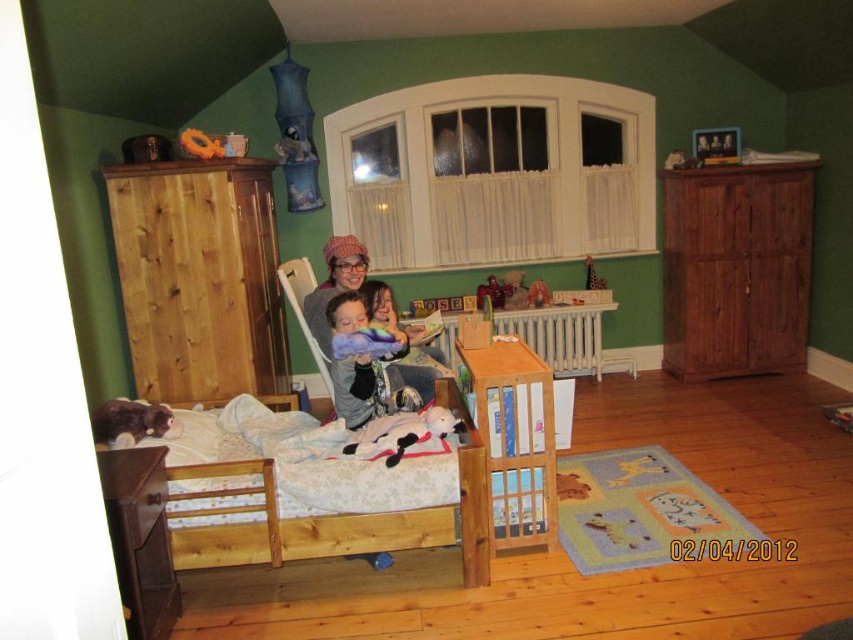
You are a child trying to reach the rubber ring at center from the soft plush toy at center. Which direction should you move to get there?

The rubber ring at center is above the soft plush toy at center, so you should move upward to reach it.

You are a parent trying to place a small toy on the purple blanket at center. The toy has a diameter of 10 cm. The point at coordinates (334, 284) is on the purple blanket. If the blanket is 1.2 meters wide, can the toy fit on the blanket without overlapping the edges?

The purple blanket at center is 1.2 meters wide, which is 120 cm. The toy has a diameter of 10 cm, so it can fit on the blanket as long as it is placed within the 120 cm width. The point at (334, 284) indicates a location on the blanket, so placing the toy there would work as the blanket is sufficiently wide.

You are a parent trying to place a rubber ring at center and a wooden toy at center on a shelf that can only hold items up to 10 cm in height. Which item should you place first to ensure both fit on the shelf?

The rubber ring at center is taller than the wooden toy at center. You should place the wooden toy at center first, then the rubber ring at center, as their combined height would be under 10 cm if each is within the limit. However, if the rubber ring alone exceeds 10 cm, it cannot be placed.